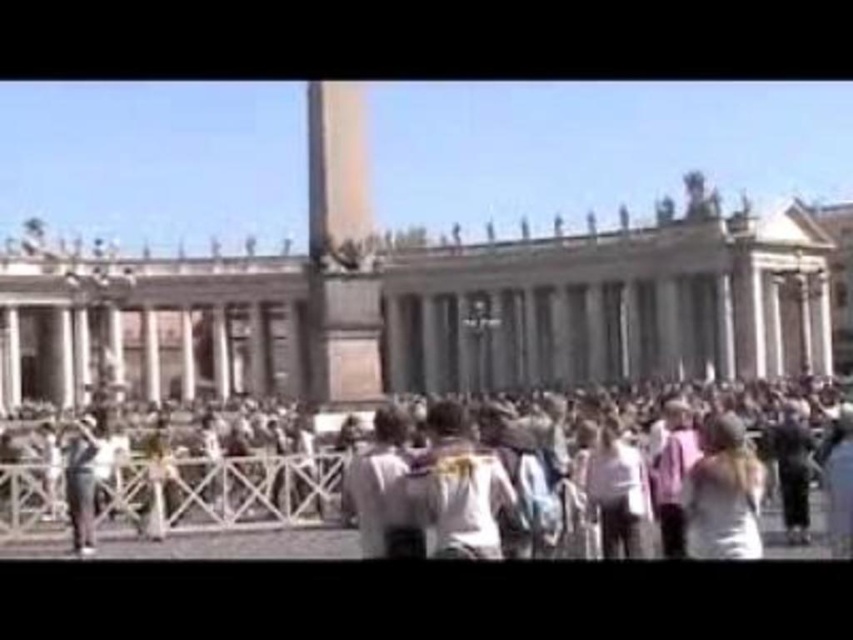
Which of these two, pink fabric shirt at center or denim jacket at lower left, stands taller?

With more height is pink fabric shirt at center.

Is the position of pink fabric shirt at center more distant than that of denim jacket at lower left?

No, pink fabric shirt at center is closer to the viewer.

What do you see at coordinates (672, 474) in the screenshot? I see `pink fabric shirt at center` at bounding box center [672, 474].

This screenshot has height=640, width=853. I want to click on pink fabric shirt at center, so click(672, 474).

Is white fabric shirt at center shorter than white matte shirt at center?

No, white fabric shirt at center is not shorter than white matte shirt at center.

Which is above, white fabric shirt at center or white matte shirt at center?

white fabric shirt at center is higher up.

You are a GUI agent. You are given a task and a screenshot of the screen. Output one action in this format:
    pyautogui.click(x=<x>, y=<y>)
    Task: Click on the white fabric shirt at center
    Image resolution: width=853 pixels, height=640 pixels.
    Given the screenshot: What is the action you would take?
    pyautogui.click(x=459, y=486)

Is white cotton shirt at center to the right of white matte shirt at center from the viewer's perspective?

Incorrect, white cotton shirt at center is not on the right side of white matte shirt at center.

Is point (410, 556) farther from viewer compared to point (610, 513)?

No, (410, 556) is in front of (610, 513).

Where is `white cotton shirt at center`? This screenshot has height=640, width=853. white cotton shirt at center is located at coordinates (383, 490).